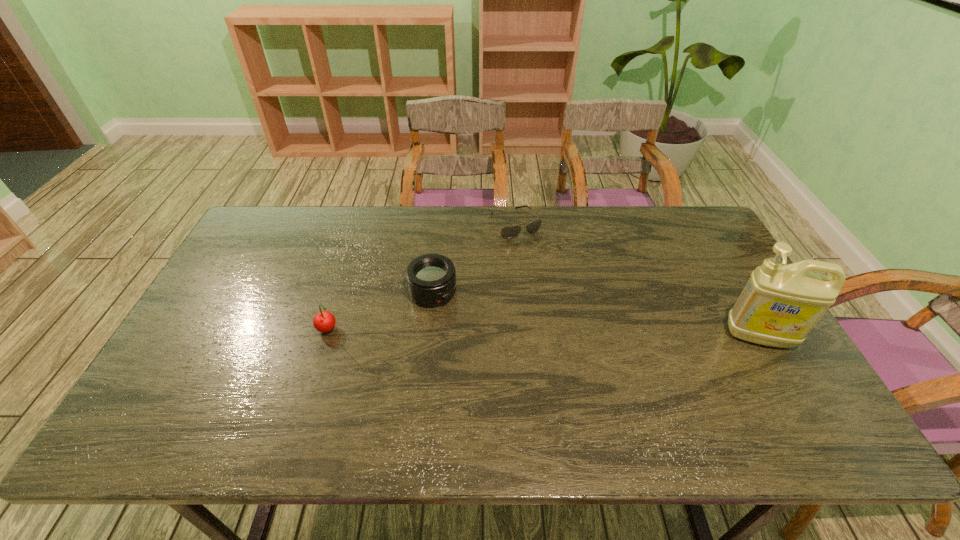
Where is `vacant region located 0.050m on the front-facing side of the sunglasses`? Image resolution: width=960 pixels, height=540 pixels. vacant region located 0.050m on the front-facing side of the sunglasses is located at coordinates (532, 248).

I want to click on free spot located 0.100m on the front-facing side of the sunglasses, so click(x=539, y=258).

The width and height of the screenshot is (960, 540). I want to click on free space located on the front-facing side of the sunglasses, so click(x=535, y=252).

The height and width of the screenshot is (540, 960). What are the coordinates of `free spot located 0.260m on the side of the telephoto lens with brand markings and control switches` in the screenshot? It's located at (518, 354).

You are a GUI agent. You are given a task and a screenshot of the screen. Output one action in this format:
    pyautogui.click(x=<x>, y=<y>)
    Task: Click on the vacant space located on the side of the telephoto lens with brand markings and control switches
    The height and width of the screenshot is (540, 960).
    Given the screenshot: What is the action you would take?
    pyautogui.click(x=482, y=328)

Identify the location of free space located 0.050m on the side of the telephoto lens with brand markings and control switches. This screenshot has height=540, width=960. (462, 313).

Where is `object that is positioned at the far edge`? object that is positioned at the far edge is located at coordinates (509, 232).

This screenshot has width=960, height=540. Identify the location of object that is at the right edge. (778, 307).

The width and height of the screenshot is (960, 540). What are the coordinates of `vacant space at the far edge` in the screenshot? It's located at (484, 219).

Locate an element on the screen. The height and width of the screenshot is (540, 960). vacant space at the near edge of the desktop is located at coordinates (686, 392).